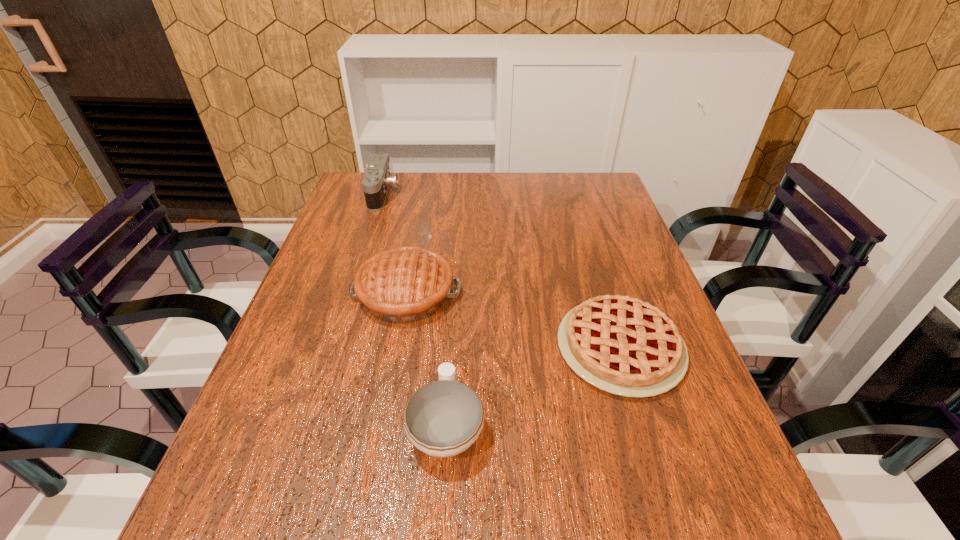
Point out which object is positioned as the nearest to the chinaware. Please provide its 2D coordinates. Your answer should be formatted as a tuple, i.e. [(x, y)], where the tuple contains the x and y coordinates of a point satisfying the conditions above.

[(401, 285)]

Where is `vacant position in the image that satisfies the following two spatial constraints: 1. on the back side of the rightmost object; 2. on the lens of the camera`? This screenshot has width=960, height=540. vacant position in the image that satisfies the following two spatial constraints: 1. on the back side of the rightmost object; 2. on the lens of the camera is located at coordinates (573, 194).

Find the location of `free space in the image that satisfies the following two spatial constraints: 1. on the lens of the camera; 2. on the left side of the left pie`. free space in the image that satisfies the following two spatial constraints: 1. on the lens of the camera; 2. on the left side of the left pie is located at coordinates (351, 293).

Locate an element on the screen. The width and height of the screenshot is (960, 540). vacant space that satisfies the following two spatial constraints: 1. on the lens of the camera; 2. on the right side of the taller pie is located at coordinates (351, 293).

At what (x,y) coordinates should I click in order to perform the action: click on vacant space that satisfies the following two spatial constraints: 1. on the front side of the rightmost object; 2. on the left side of the taller pie. Please return your answer as a coordinate pair (x, y). This screenshot has width=960, height=540. Looking at the image, I should click on (396, 347).

Find the location of a particular element. vacant area that satisfies the following two spatial constraints: 1. on the lens of the farthest object; 2. on the left side of the left pie is located at coordinates (351, 293).

At what (x,y) coordinates should I click in order to perform the action: click on vacant position in the image that satisfies the following two spatial constraints: 1. on the side with the handle of the second shortest object; 2. on the lens of the camera. Please return your answer as a coordinate pair (x, y). Looking at the image, I should click on (461, 194).

Where is `vacant space that satisfies the following two spatial constraints: 1. on the lens of the left pie; 2. on the left side of the farthest object`? The image size is (960, 540). vacant space that satisfies the following two spatial constraints: 1. on the lens of the left pie; 2. on the left side of the farthest object is located at coordinates (351, 293).

Identify the location of free space that satisfies the following two spatial constraints: 1. on the lens of the camera; 2. on the right side of the taller pie. The image size is (960, 540). (351, 293).

Find the location of `free region that satisfies the following two spatial constraints: 1. on the lens of the camera; 2. on the side with the handle of the chinaware`. free region that satisfies the following two spatial constraints: 1. on the lens of the camera; 2. on the side with the handle of the chinaware is located at coordinates (308, 426).